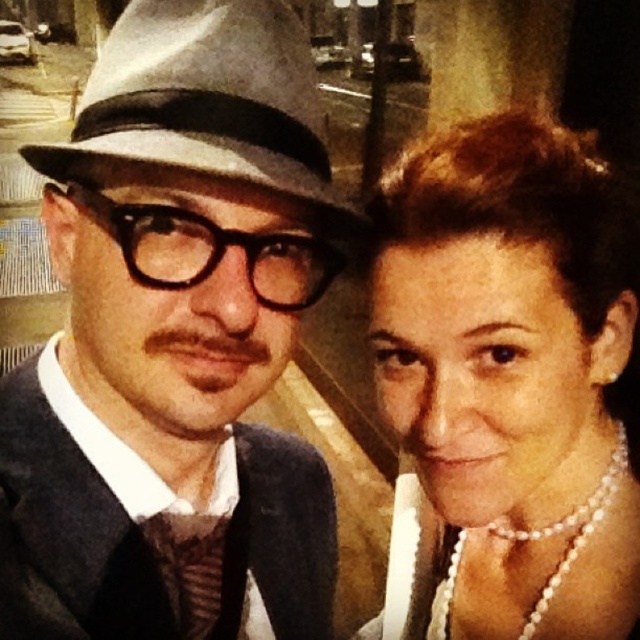
Question: Can you confirm if gray felt fedora at left is positioned to the left of striped fabric tie at center?

Choices:
 (A) yes
 (B) no

Answer: (A)

Question: Which point appears farthest from the camera in this image?

Choices:
 (A) (470, 323)
 (B) (99, 132)
 (C) (128, 486)

Answer: (C)

Question: Does pearl necklace at upper right appear under striped fabric tie at center?

Choices:
 (A) yes
 (B) no

Answer: (B)

Question: Can you confirm if gray felt fedora at left is thinner than striped fabric tie at center?

Choices:
 (A) yes
 (B) no

Answer: (B)

Question: Among these points, which one is nearest to the camera?

Choices:
 (A) (17, 532)
 (B) (186, 586)

Answer: (A)

Question: Estimate the real-world distances between objects in this image. Which object is closer to the gray felt fedora at left?

Choices:
 (A) pearl necklace at upper right
 (B) dark blue woolen suit at center

Answer: (A)